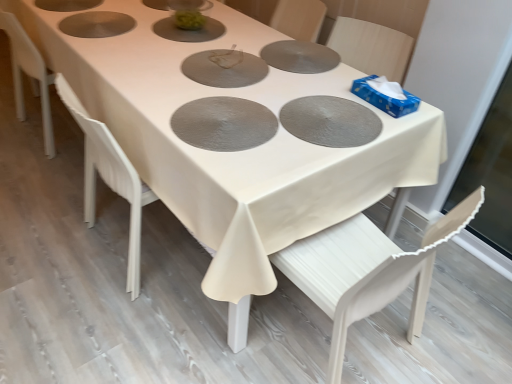
The image size is (512, 384). Find the location of `free space behind matte gray pizza pan at center, which is the second pizza pan in bottom-to-top order`. free space behind matte gray pizza pan at center, which is the second pizza pan in bottom-to-top order is located at coordinates (309, 75).